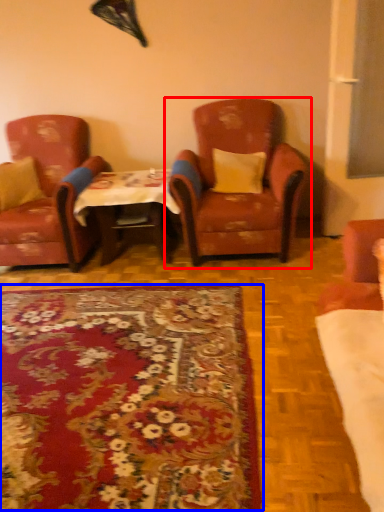
Question: Which point is closer to the camera, chair (highlighted by a red box) or mat (highlighted by a blue box)?

Choices:
 (A) chair
 (B) mat

Answer: (B)